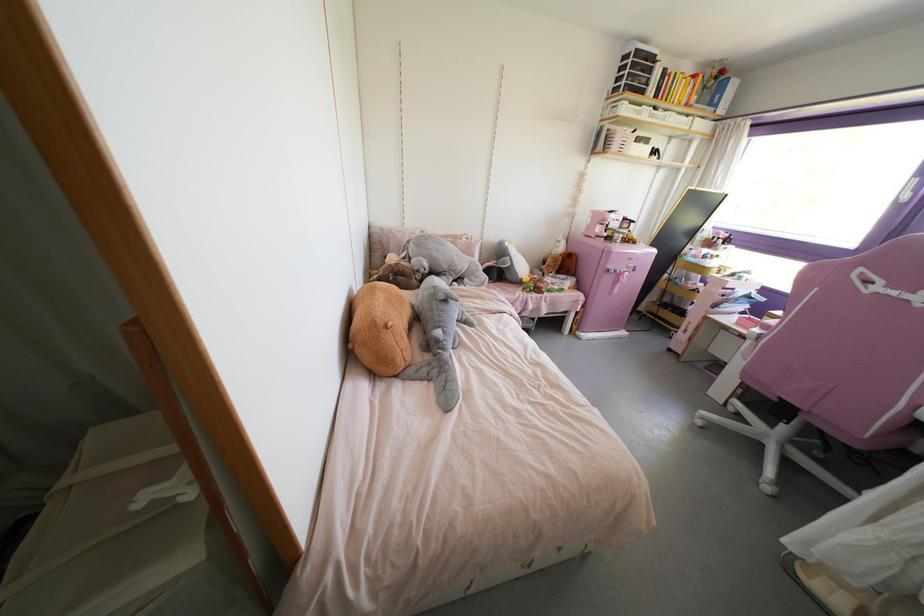
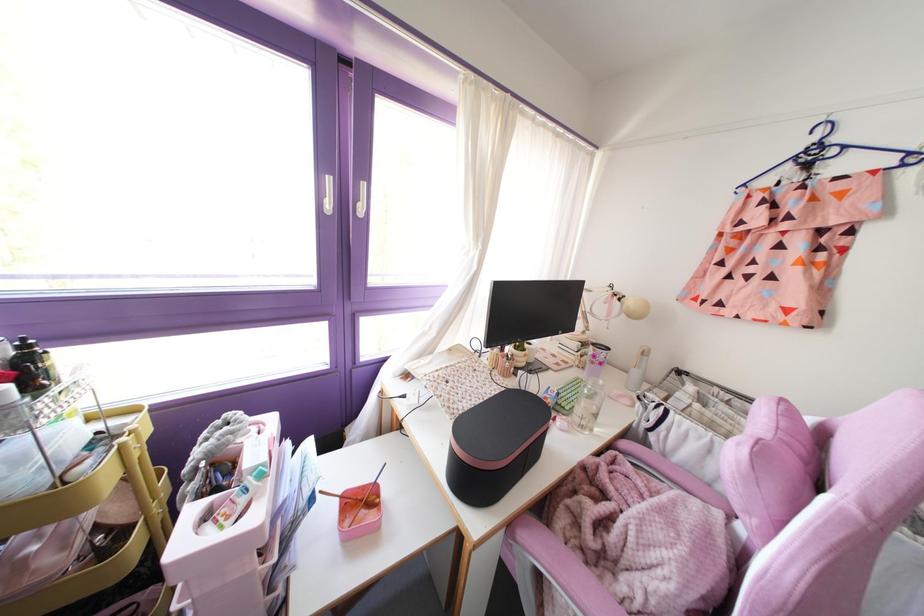
In the second image, find the point that corresponds to pixel 723 243 in the first image.

(32, 389)